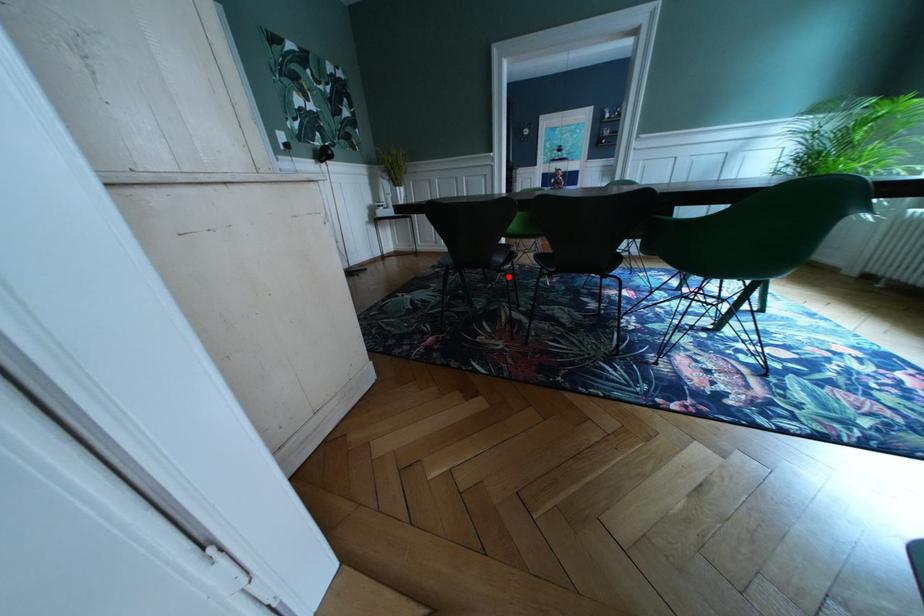
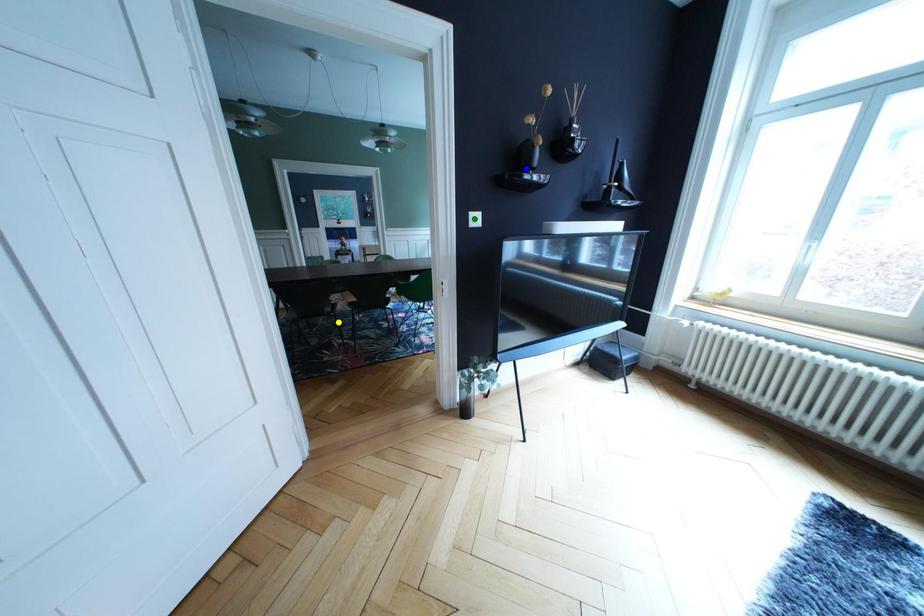
Question: I am providing you with two images of the same scene from different viewpoints. A red point is marked on the first image. You are given multiple points on the second image. In image 2, which mark is for the same physical point as the one in image 1?

Choices:
 (A) yellow point
 (B) green point
 (C) blue point

Answer: (A)